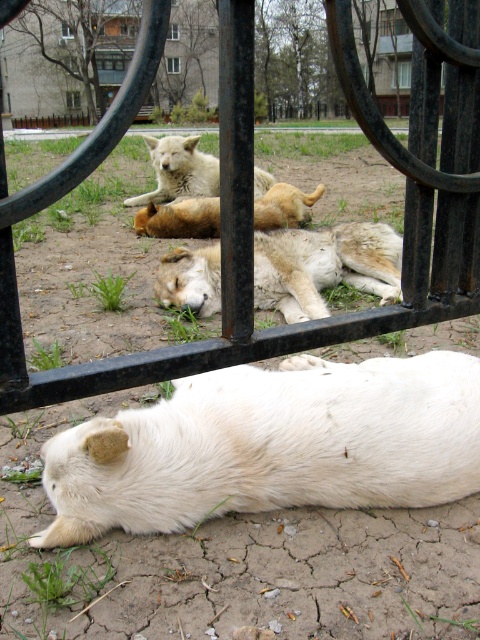
Question: Where is white fur dog at center located in relation to golden fur dog at center in the image?

Choices:
 (A) below
 (B) above

Answer: (A)

Question: Where is black metal gate at center located in relation to golden fur dog at center in the image?

Choices:
 (A) right
 (B) left

Answer: (B)

Question: Is white fur dog at center to the left of golden fur dog at center from the viewer's perspective?

Choices:
 (A) yes
 (B) no

Answer: (B)

Question: Among these points, which one is farthest from the camera?

Choices:
 (A) (322, 189)
 (B) (389, 417)
 (C) (291, 232)

Answer: (A)

Question: Considering the real-world distances, which object is closest to the white fur dog at upper center?

Choices:
 (A) white fluffy dog at center
 (B) black metal gate at center
 (C) golden fur dog at center
 (D) white fur dog at center

Answer: (C)

Question: Which point is farther from the camera taking this photo?

Choices:
 (A) (168, 176)
 (B) (292, 195)

Answer: (A)